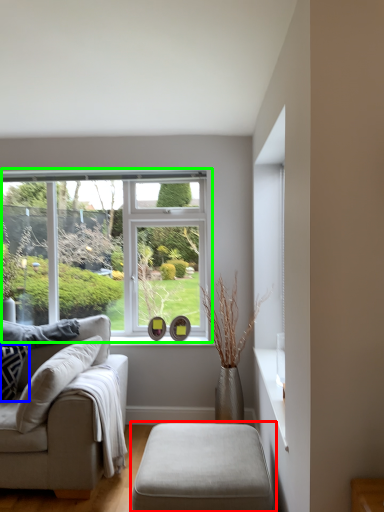
Question: Based on their relative distances, which object is farther from table (highlighted by a red box)? Choose from pillow (highlighted by a blue box) and window (highlighted by a green box).

Choices:
 (A) pillow
 (B) window

Answer: (B)